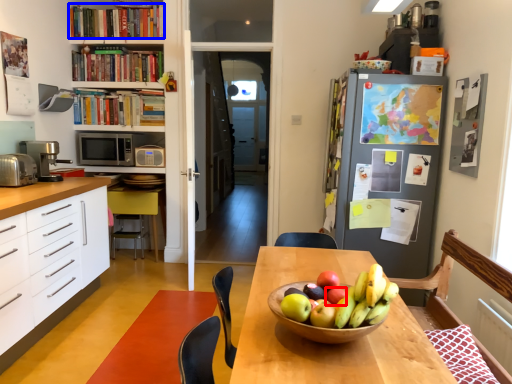
Question: Which point is closer to the camera, apple (highlighted by a red box) or book (highlighted by a blue box)?

Choices:
 (A) apple
 (B) book

Answer: (A)